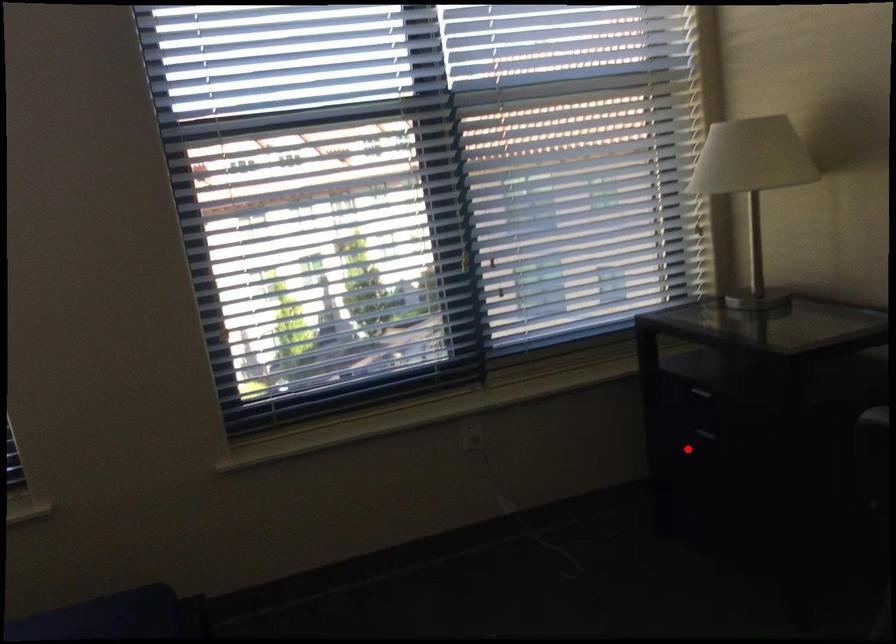
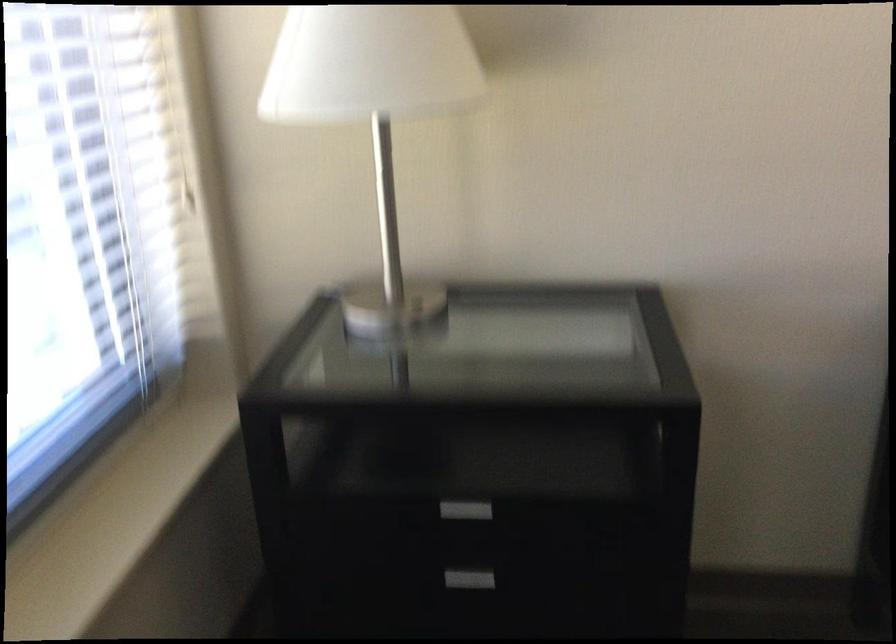
Question: I am providing you with two images of the same scene from different viewpoints. In image1, a red point is highlighted. Considering the same 3D point in image2, which of the following is correct?

Choices:
 (A) It is closer
 (B) It is farther

Answer: (A)